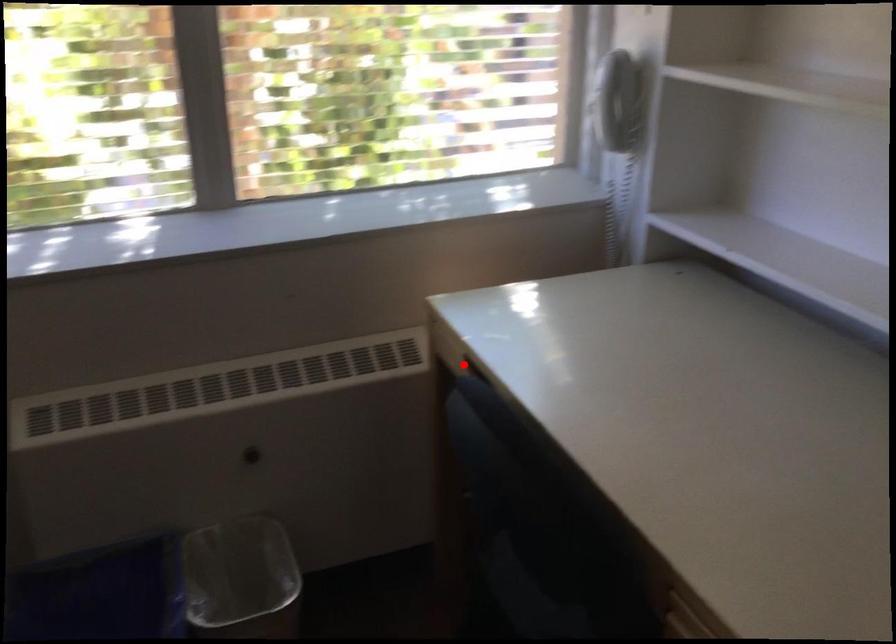
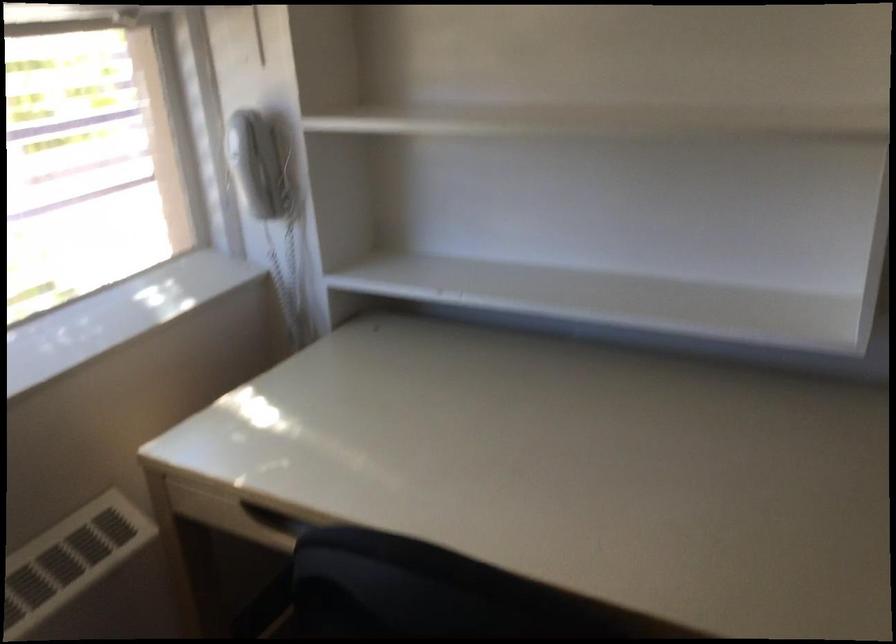
The point at the highlighted location is marked in the first image. Where is the corresponding point in the second image?

(239, 516)